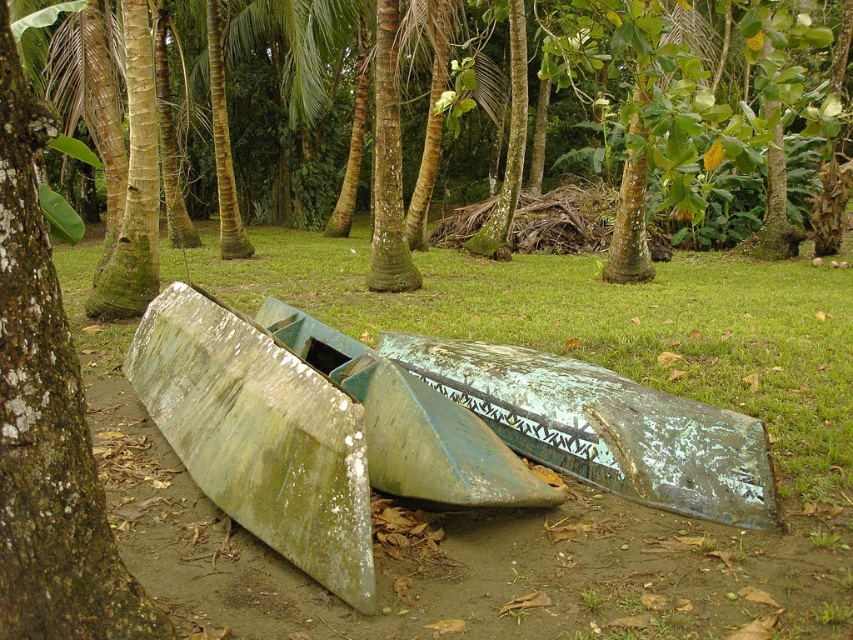
Question: Estimate the real-world distances between objects in this image. Which object is farther from the green weathered wood boat at center?

Choices:
 (A) green mossy canoe at lower center
 (B) green mossy bark tree at left

Answer: (A)

Question: Is green mossy canoe at lower center wider than green weathered wood boat at center?

Choices:
 (A) no
 (B) yes

Answer: (B)

Question: Does green grass at center appear on the right side of green mossy canoe at lower center?

Choices:
 (A) yes
 (B) no

Answer: (B)

Question: Is green grass at center above green mossy bark tree at left?

Choices:
 (A) no
 (B) yes

Answer: (B)

Question: Considering the real-world distances, which object is farthest from the green patina wood boat at center?

Choices:
 (A) green mossy wood boat at lower left
 (B) green mossy bark tree at left

Answer: (B)

Question: Which object appears farthest from the camera in this image?

Choices:
 (A) green mossy bark tree at left
 (B) green grass at center
 (C) green mossy wood boat at lower left
 (D) green patina wood boat at center

Answer: (D)